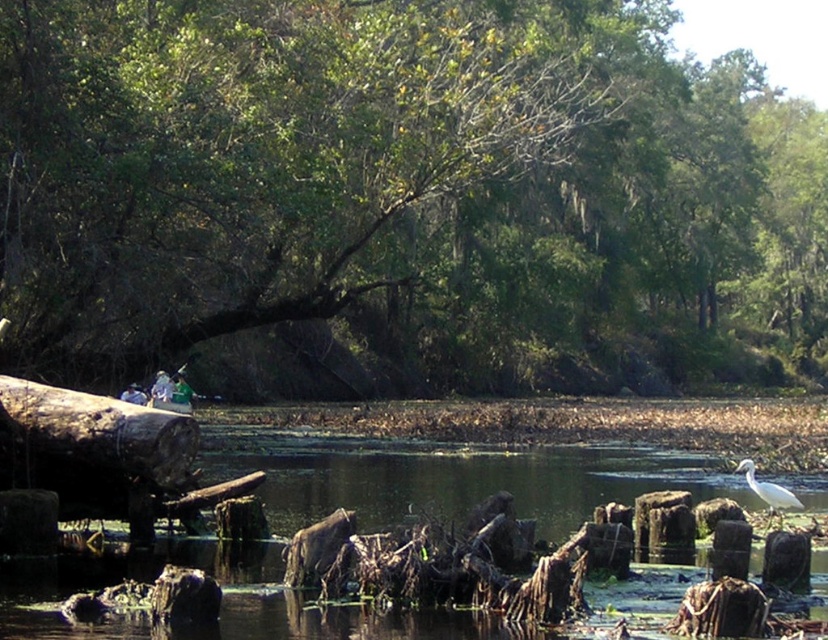
In the scene shown: Who is more forward, (80, 225) or (740, 465)?

Point (740, 465) is in front.

Describe the element at coordinates (402, 198) in the screenshot. I see `green leafy tree at upper center` at that location.

Is point (802, 164) farther from camera compared to point (797, 500)?

Yes, point (802, 164) is farther from viewer.

Identify the location of green leafy tree at upper center. This screenshot has height=640, width=828. (402, 198).

Which is behind, point (138, 324) or point (142, 444)?

The point (138, 324) is behind.

Does point (17, 129) come in front of point (152, 451)?

No.

In order to click on green leafy tree at upper center in this screenshot , I will do `click(402, 198)`.

Where is `green leafy tree at upper center`? green leafy tree at upper center is located at coordinates (402, 198).

Can you confirm if rough wooden log at left is smaller than white matte bird at lower right?

Yes, rough wooden log at left is smaller than white matte bird at lower right.

Is point (80, 438) less distant than point (766, 525)?

That is True.

The height and width of the screenshot is (640, 828). Describe the element at coordinates (100, 429) in the screenshot. I see `rough wooden log at left` at that location.

Where is `rough wooden log at left`? This screenshot has height=640, width=828. rough wooden log at left is located at coordinates (100, 429).